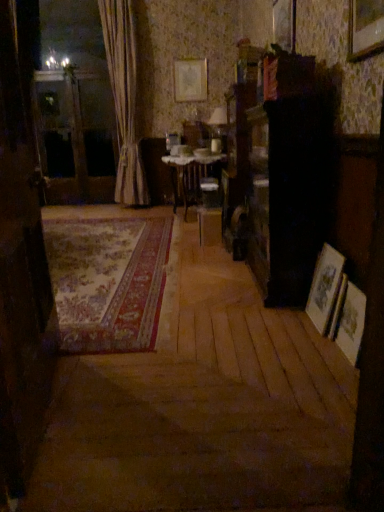
The image size is (384, 512). What are the coordinates of `white lace table at center` in the screenshot? It's located at (190, 175).

What do you see at coordinates (108, 281) in the screenshot? I see `carpeted rug at center` at bounding box center [108, 281].

This screenshot has height=512, width=384. In order to click on wooden picture frame at right, which is the 3th picture frame from back to front in this screenshot , I will do `click(324, 287)`.

At what (x,y) coordinates should I click in order to perform the action: click on matte gold picture frame at upper center, the first picture frame when ordered from back to front. Please return your answer as a coordinate pair (x, y). Image resolution: width=384 pixels, height=512 pixels. Looking at the image, I should click on (191, 80).

This screenshot has height=512, width=384. Describe the element at coordinates (351, 323) in the screenshot. I see `wooden picture frame at lower right, the 1th picture frame in the right-to-left sequence` at that location.

Image resolution: width=384 pixels, height=512 pixels. Identify the location of white lace table at center. (190, 175).

From the image's perspective, between carpeted rug at center and wooden picture frame at lower right, which is the 4th picture frame in left-to-right order, which one is located above?

carpeted rug at center appears higher in the image.

Looking at the image, does carpeted rug at center seem bigger or smaller compared to wooden picture frame at lower right, the 1th picture frame in the bottom-to-top sequence?

In the image, carpeted rug at center appears to be larger than wooden picture frame at lower right, the 1th picture frame in the bottom-to-top sequence.

Can wooden picture frame at lower right, placed as the 1th picture frame when sorted from front to back, be found inside carpeted rug at center?

No, wooden picture frame at lower right, placed as the 1th picture frame when sorted from front to back, is located outside of carpeted rug at center.

Considering the sizes of carpeted rug at center and wooden picture frame at lower right, which is the 4th picture frame in left-to-right order, in the image, is carpeted rug at center wider or thinner than wooden picture frame at lower right, which is the 4th picture frame in left-to-right order,?

Clearly, carpeted rug at center has more width compared to wooden picture frame at lower right, which is the 4th picture frame in left-to-right order.

From the image's perspective, starting from the wooden picture frame at lower right, the 1th picture frame in the bottom-to-top sequence, which picture frame is the 3rd one above? Please provide its 2D coordinates.

[(191, 80)]

From the image's perspective, which is above, wooden picture frame at lower right, the 1th picture frame in the bottom-to-top sequence, or matte gold picture frame at upper center, acting as the first picture frame starting from the left?

matte gold picture frame at upper center, acting as the first picture frame starting from the left, from the image's perspective.

Is wooden picture frame at lower right, placed as the 1th picture frame when sorted from front to back, outside of matte gold picture frame at upper center, the first picture frame in the top-to-bottom sequence?

Indeed, wooden picture frame at lower right, placed as the 1th picture frame when sorted from front to back, is completely outside matte gold picture frame at upper center, the first picture frame in the top-to-bottom sequence.

Can you tell me how much wooden picture frame at lower right, placed as the 1th picture frame when sorted from front to back, and matte gold picture frame at upper center, the fourth picture frame from the bottom, differ in facing direction?

The angle between the facing direction of wooden picture frame at lower right, placed as the 1th picture frame when sorted from front to back, and the facing direction of matte gold picture frame at upper center, the fourth picture frame from the bottom, is 90.3 degrees.

From the wooden picture frame at upper center, the 2th picture frame in the back-to-front sequence, count the 1st picture frame to the left and point to it. Please provide its 2D coordinates.

[(324, 287)]

Considering the sizes of objects wooden picture frame at right, which is the 3th picture frame from back to front, and wooden picture frame at upper center, positioned as the 2th picture frame in top-to-bottom order, in the image provided, who is shorter, wooden picture frame at right, which is the 3th picture frame from back to front, or wooden picture frame at upper center, positioned as the 2th picture frame in top-to-bottom order,?

With less height is wooden picture frame at upper center, positioned as the 2th picture frame in top-to-bottom order.

Is wooden picture frame at right, the second picture frame when ordered from bottom to top, in front of or behind wooden picture frame at upper center, positioned as the 2th picture frame in top-to-bottom order, in the image?

Clearly, wooden picture frame at right, the second picture frame when ordered from bottom to top, is in front of wooden picture frame at upper center, positioned as the 2th picture frame in top-to-bottom order.

From a real-world perspective, is wooden picture frame at right, which is counted as the second picture frame, starting from the left, positioned above or below wooden picture frame at upper center, marked as the 3th picture frame in a left-to-right arrangement?

From a real-world perspective, wooden picture frame at right, which is counted as the second picture frame, starting from the left, is physically below wooden picture frame at upper center, marked as the 3th picture frame in a left-to-right arrangement.

In the scene shown: Considering the relative sizes of matte gold picture frame at upper center, positioned as the fourth picture frame in right-to-left order, and white textured curtain at left in the image provided, is matte gold picture frame at upper center, positioned as the fourth picture frame in right-to-left order, taller than white textured curtain at left?

In fact, matte gold picture frame at upper center, positioned as the fourth picture frame in right-to-left order, may be shorter than white textured curtain at left.

Consider the image. Which object is thinner, matte gold picture frame at upper center, the first picture frame when ordered from back to front, or white textured curtain at left?

matte gold picture frame at upper center, the first picture frame when ordered from back to front.

Considering the relative sizes of matte gold picture frame at upper center, positioned as the fourth picture frame in right-to-left order, and white textured curtain at left in the image provided, is matte gold picture frame at upper center, positioned as the fourth picture frame in right-to-left order, smaller than white textured curtain at left?

Yes.

Does transparent glass screen door at left, the first screen door positioned from the left, contain matte gold picture frame at upper center, the first picture frame when ordered from back to front?

No, matte gold picture frame at upper center, the first picture frame when ordered from back to front, is not surrounded by transparent glass screen door at left, the first screen door positioned from the left.

Is transparent glass screen door at left, marked as the second screen door in a front-to-back arrangement, next to matte gold picture frame at upper center, the first picture frame when ordered from back to front?

No, transparent glass screen door at left, marked as the second screen door in a front-to-back arrangement, is not beside matte gold picture frame at upper center, the first picture frame when ordered from back to front.

In terms of width, does transparent glass screen door at left, which is counted as the second screen door, starting from the right, look wider or thinner when compared to matte gold picture frame at upper center, which is counted as the 4th picture frame, starting from the front?

transparent glass screen door at left, which is counted as the second screen door, starting from the right, is wider than matte gold picture frame at upper center, which is counted as the 4th picture frame, starting from the front.

Is transparent glass screen door at left, the first screen door positioned from the left, bigger than matte gold picture frame at upper center, which is counted as the 4th picture frame, starting from the front?

Indeed, transparent glass screen door at left, the first screen door positioned from the left, has a larger size compared to matte gold picture frame at upper center, which is counted as the 4th picture frame, starting from the front.

Would you say wooden picture frame at right, acting as the 3th picture frame starting from the top, contains carpeted rug at center?

No, carpeted rug at center is not inside wooden picture frame at right, acting as the 3th picture frame starting from the top.

Considering the sizes of objects wooden picture frame at right, the second picture frame when ordered from bottom to top, and carpeted rug at center in the image provided, who is smaller, wooden picture frame at right, the second picture frame when ordered from bottom to top, or carpeted rug at center?

wooden picture frame at right, the second picture frame when ordered from bottom to top.

Is the position of wooden picture frame at right, the 3th picture frame from the right, more distant than that of carpeted rug at center?

That is False.

Based on their positions, is wooden picture frame at right, which is the 3th picture frame from back to front, located to the left or right of carpeted rug at center?

Based on their positions, wooden picture frame at right, which is the 3th picture frame from back to front, is located to the right of carpeted rug at center.

Can you confirm if white textured curtain at left is bigger than carpeted rug at center?

Indeed, white textured curtain at left has a larger size compared to carpeted rug at center.

Based on the photo, from a real-world perspective, relative to carpeted rug at center, is white textured curtain at left vertically above or below?

From a real-world perspective, white textured curtain at left is physically above carpeted rug at center.

Which is in front, point (127, 149) or point (53, 250)?

Point (53, 250)

In the scene shown: Is white textured curtain at left positioned beyond the bounds of carpeted rug at center?

Yes.

Find the location of a particular element. the 1st picture frame located above the carpeted rug at center (from a real-world perspective) is located at coordinates (351, 323).

From the matte gold picture frame at upper center, the first picture frame when ordered from back to front, count 3rd picture frame to the right and point to it. Please provide its 2D coordinates.

[(351, 323)]

Which object lies further to the anchor point wooden picture frame at upper center, the 2th picture frame in the back-to-front sequence, transparent glass screen door at left, the 1th screen door when ordered from back to front, or white textured curtain at left?

The object further to wooden picture frame at upper center, the 2th picture frame in the back-to-front sequence, is transparent glass screen door at left, the 1th screen door when ordered from back to front.

Based on their spatial positions, is matte gold picture frame at upper center, positioned as the fourth picture frame in right-to-left order, or wooden picture frame at upper center, marked as the 2th picture frame in a right-to-left arrangement, further from carpeted rug at center?

matte gold picture frame at upper center, positioned as the fourth picture frame in right-to-left order, is positioned further to the anchor carpeted rug at center.

Consider the image. Estimate the real-world distances between objects in this image. Which object is closer to white lace table at center, wooden picture frame at lower right, the 1th picture frame in the right-to-left sequence, or matte gold picture frame at upper center, the fourth picture frame from the bottom?

Based on the image, matte gold picture frame at upper center, the fourth picture frame from the bottom, appears to be nearer to white lace table at center.

From the image, which object appears to be nearer to transparent glass screen door at left, the first screen door positioned from the left, wooden picture frame at right, the 3th picture frame from the right, or matte gold picture frame at upper center, the fourth picture frame from the bottom?

matte gold picture frame at upper center, the fourth picture frame from the bottom, is closer to transparent glass screen door at left, the first screen door positioned from the left.

Looking at the image, which one is located closer to transparent glass screen door at left, acting as the second screen door starting from the left, white textured curtain at left or wooden picture frame at right, which is counted as the second picture frame, starting from the left?

wooden picture frame at right, which is counted as the second picture frame, starting from the left, is closer to transparent glass screen door at left, acting as the second screen door starting from the left.

Looking at the image, which one is located further to wooden picture frame at right, the second picture frame when ordered from bottom to top, wooden picture frame at lower right, the 1th picture frame in the bottom-to-top sequence, or transparent glass screen door at left, the first screen door positioned from the left?

transparent glass screen door at left, the first screen door positioned from the left.

When comparing their distances from white lace table at center, does carpeted rug at center or matte gold picture frame at upper center, the fourth picture frame from the bottom, seem closer?

matte gold picture frame at upper center, the fourth picture frame from the bottom.

Looking at the image, which one is located further to carpeted rug at center, white textured curtain at left or wooden picture frame at upper center, marked as the 3th picture frame in a left-to-right arrangement?

white textured curtain at left is further to carpeted rug at center.

Locate an element on the screen. The width and height of the screenshot is (384, 512). curtain between wooden picture frame at right, which is the 3th picture frame from back to front, and matte gold picture frame at upper center, the first picture frame in the top-to-bottom sequence, along the z-axis is located at coordinates (124, 99).

Identify the location of curtain positioned between wooden picture frame at upper center, marked as the 3th picture frame in a left-to-right arrangement, and transparent glass screen door at left, the first screen door positioned from the left, from near to far. Image resolution: width=384 pixels, height=512 pixels. (124, 99).

What are the coordinates of `curtain positioned between transparent glass screen door at left, the first screen door from the front, and transparent glass screen door at left, the 1th screen door when ordered from back to front, from near to far` in the screenshot? It's located at (124, 99).

Where is `table located between transparent glass screen door at left, placed as the second screen door when sorted from top to bottom, and white textured curtain at left in the depth direction`? Image resolution: width=384 pixels, height=512 pixels. table located between transparent glass screen door at left, placed as the second screen door when sorted from top to bottom, and white textured curtain at left in the depth direction is located at coordinates (190, 175).